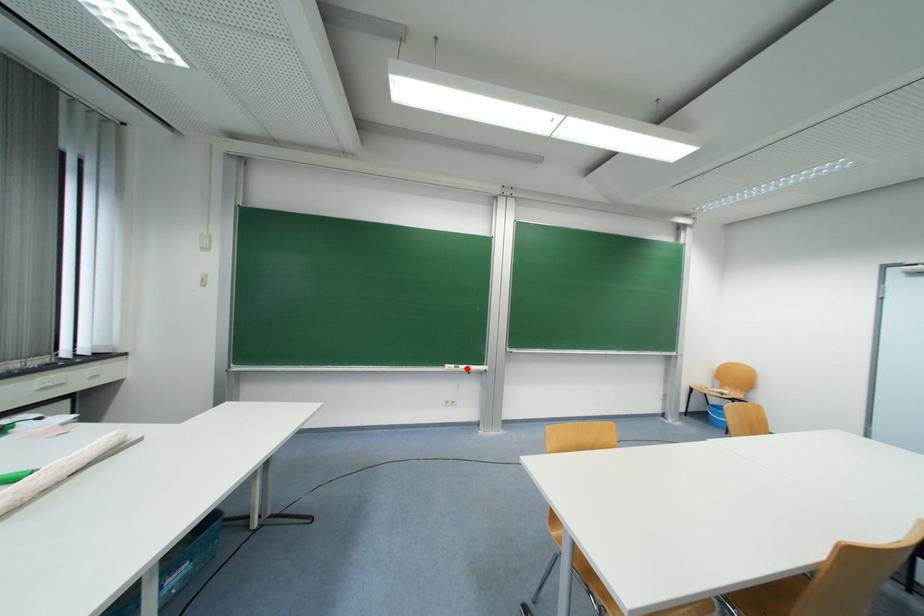
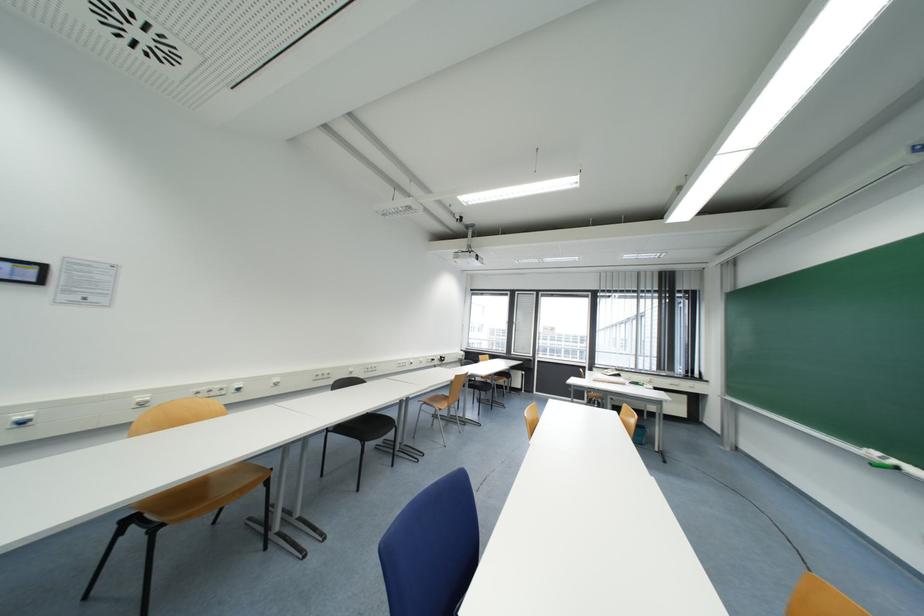
Where in the second image is the point corresponding to the highlighted location from the first image?

(898, 464)